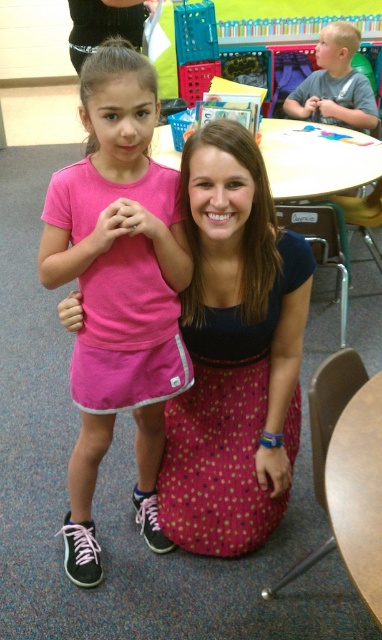
You are a photographer adjusting your camera settings to capture the scene. You notice the pink fabric skirt at center and the black hair at upper left. Which object is positioned higher in the image?

The pink fabric skirt at center is taller than the black hair at upper left, so the pink fabric skirt at center is positioned higher in the image.

You are a photographer trying to capture a group photo of the blonde hair boy at upper right and the black hair at upper left. Which subject should you focus on first if you want to ensure both are in focus, considering their sizes?

The black hair at upper left should be focused on first because it is smaller in size compared to the blonde hair boy at upper right, allowing for better depth of field coverage.